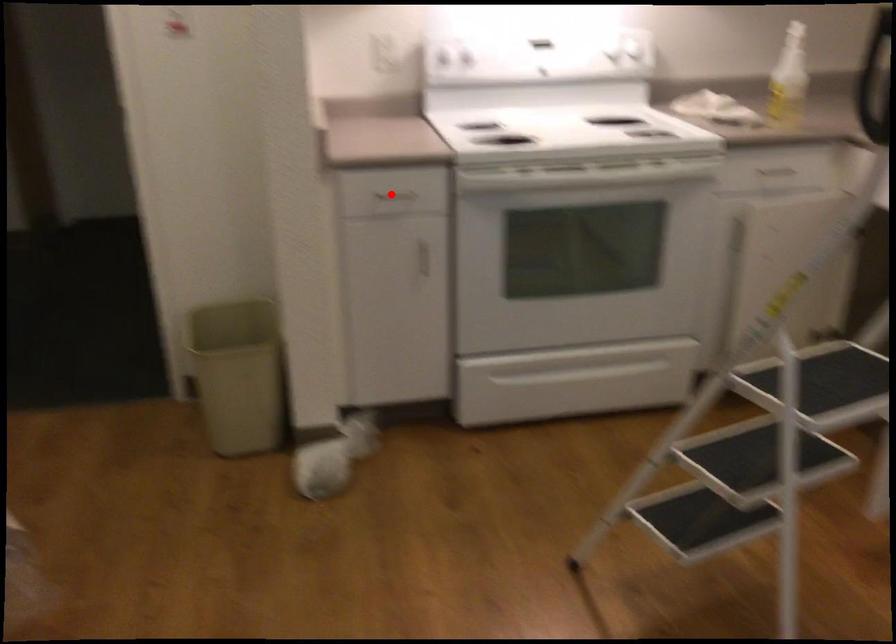
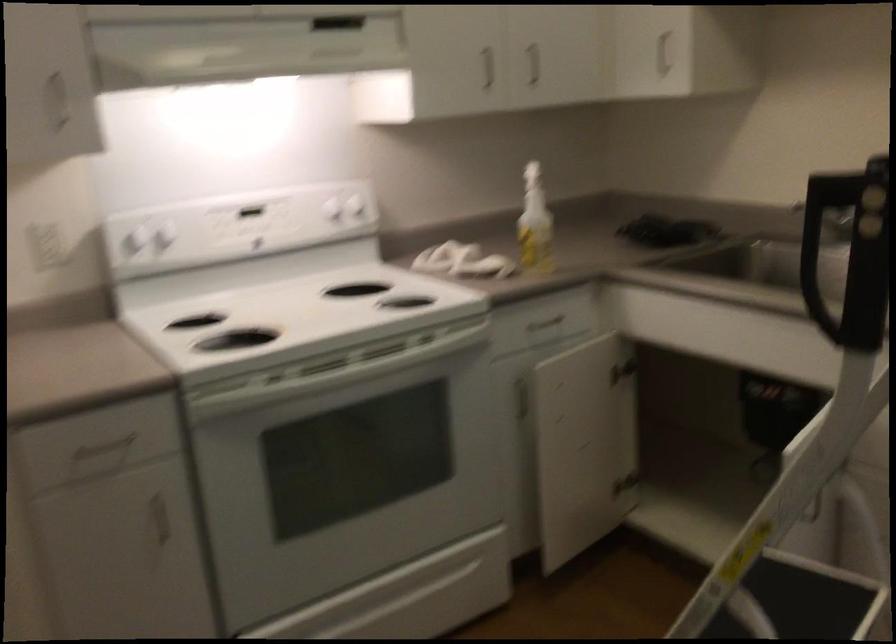
Question: I am providing you with two images of the same scene from different viewpoints. Given a red point in image1, look at the same physical point in image2. Is it:

Choices:
 (A) Closer to the viewpoint
 (B) Farther from the viewpoint

Answer: (A)